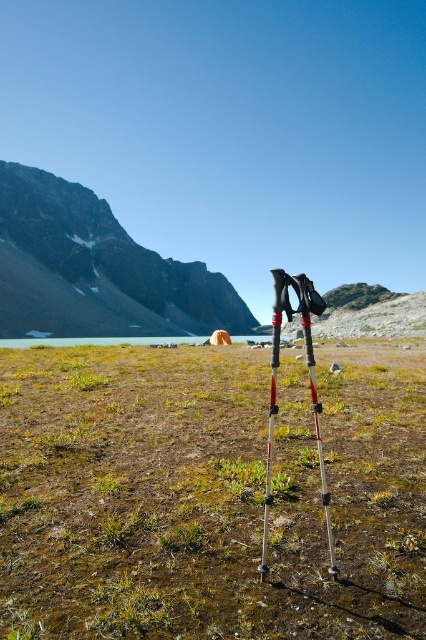
Based on the photo, you are a hiker who wants to set up a tent in this area. Based on the scene, which location would be more suitable for the tent between the green grass at center and the rugged stone mountain at upper left? Explain your reasoning.

The green grass at center is shorter than the rugged stone mountain at upper left, so the green grass at center would be more suitable for setting up the tent. The shorter grass provides a flatter and more stable surface compared to the uneven terrain of the rugged stone mountain.